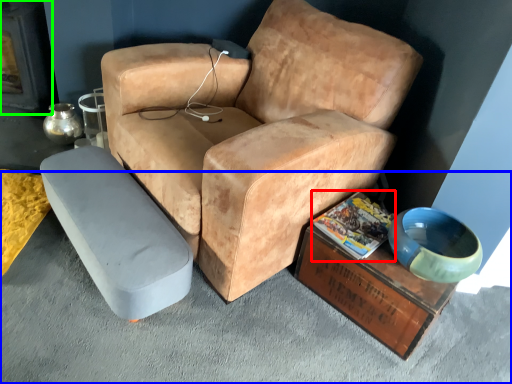
Question: Which object is the closest to the magazine (highlighted by a red box)? Choose among these: concrete (highlighted by a blue box) or fireplace (highlighted by a green box).

Choices:
 (A) concrete
 (B) fireplace

Answer: (A)